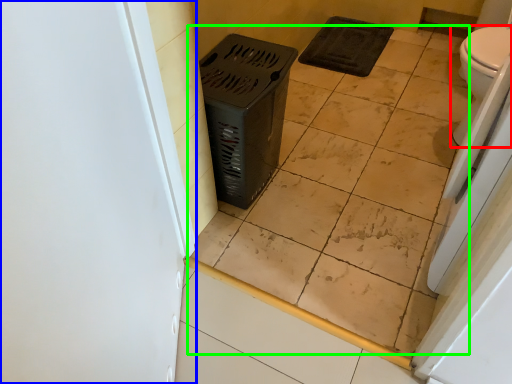
Question: Considering the real-world distances, which object is farthest from toilet (highlighted by a red box)? screen door (highlighted by a blue box) or ceramic tile (highlighted by a green box)?

Choices:
 (A) screen door
 (B) ceramic tile

Answer: (A)